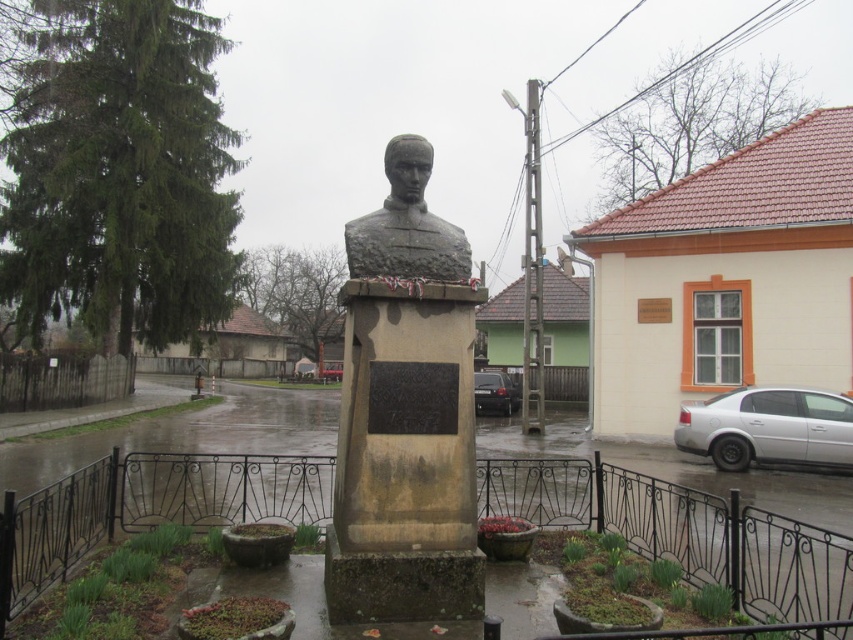
Consider the image. You are a photographer trying to capture the slate stone bust at center in your shot. There is a silver metallic car at lower right nearby. Given their sizes, which object will appear larger in the photo?

The slate stone bust at center will appear larger in the photo because it is bigger than the silver metallic car at lower right.

You are a photographer wanting to capture both the stone bust at center and the black glossy car at center in a single frame. Based on their positions, which object should you place closer to the left side of your camera viewfinder?

The stone bust at center is positioned on the left side of black glossy car at center, so to capture both in a single frame, you should place the stone bust at center closer to the left side of your camera viewfinder.

You are a tour guide leading a group to a monument. You see the slate stone bust at center and the black glossy car at center. Can you tell the visitors how far apart these two objects are?

The slate stone bust at center is 12.00 meters away from the black glossy car at center.